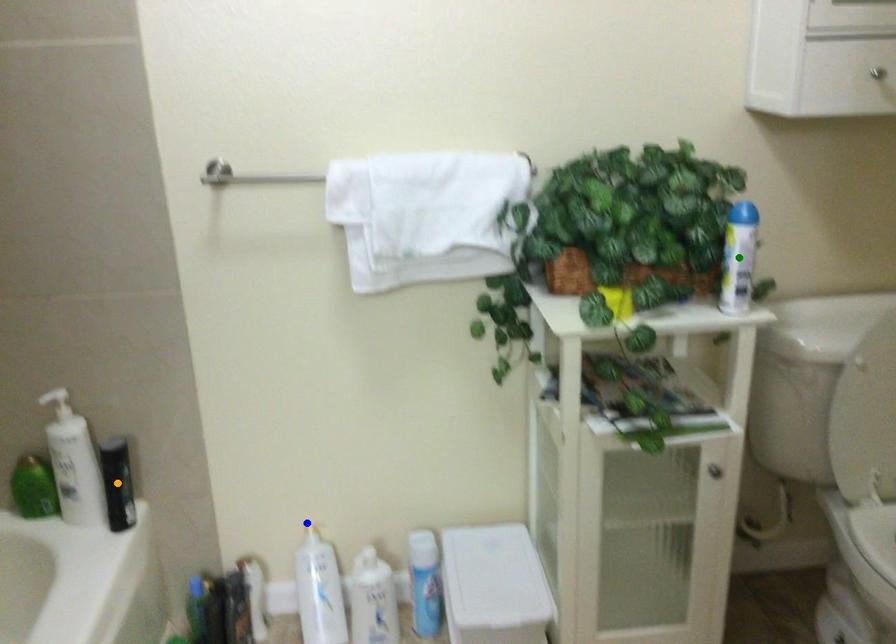
Order these from nearest to farthest:
blue point, orange point, green point

blue point < orange point < green point